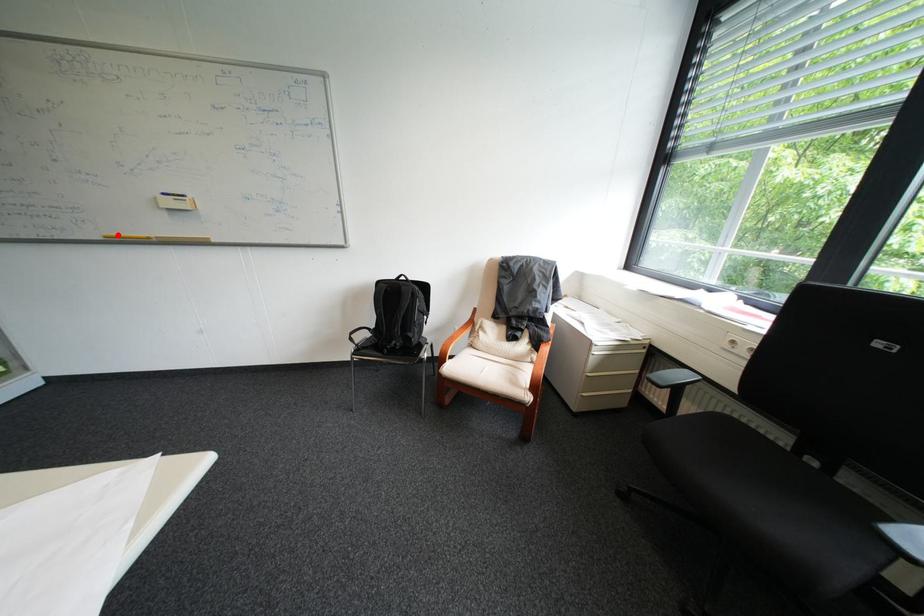
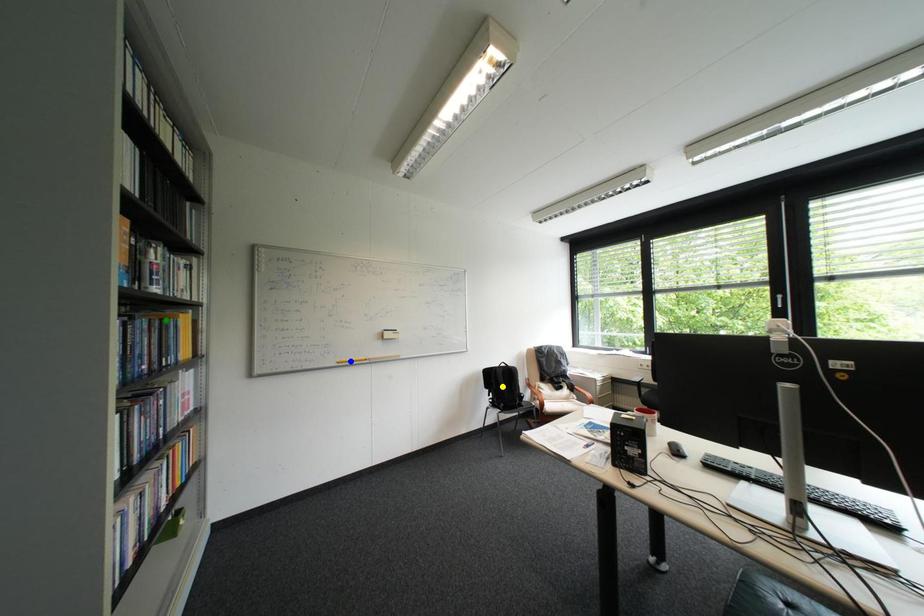
Question: I am providing you with two images of the same scene from different viewpoints. A red point is marked on the first image. You are given multiple points on the second image. Which point in image 2 represents the same 3d spot as the red point in image 1?

Choices:
 (A) yellow point
 (B) blue point
 (C) green point

Answer: (B)